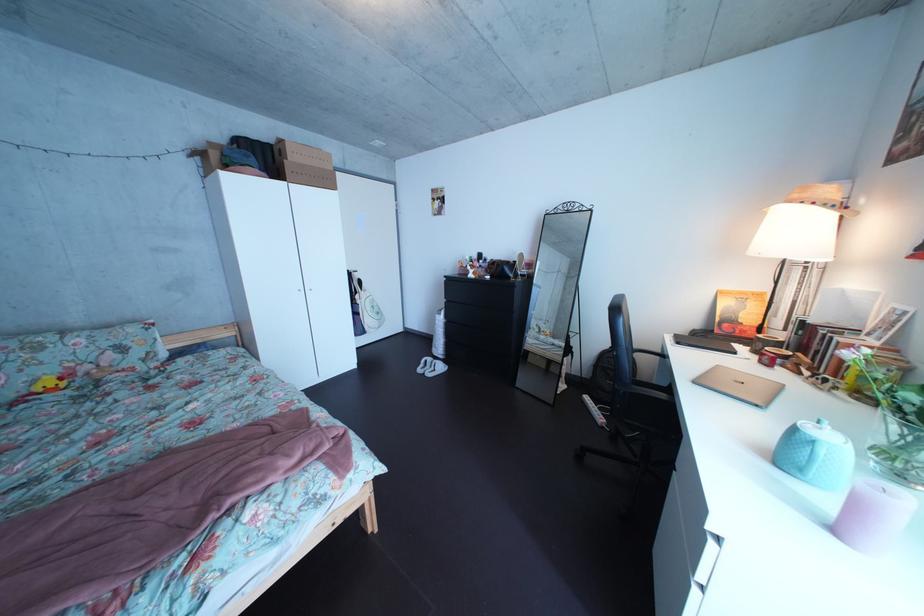
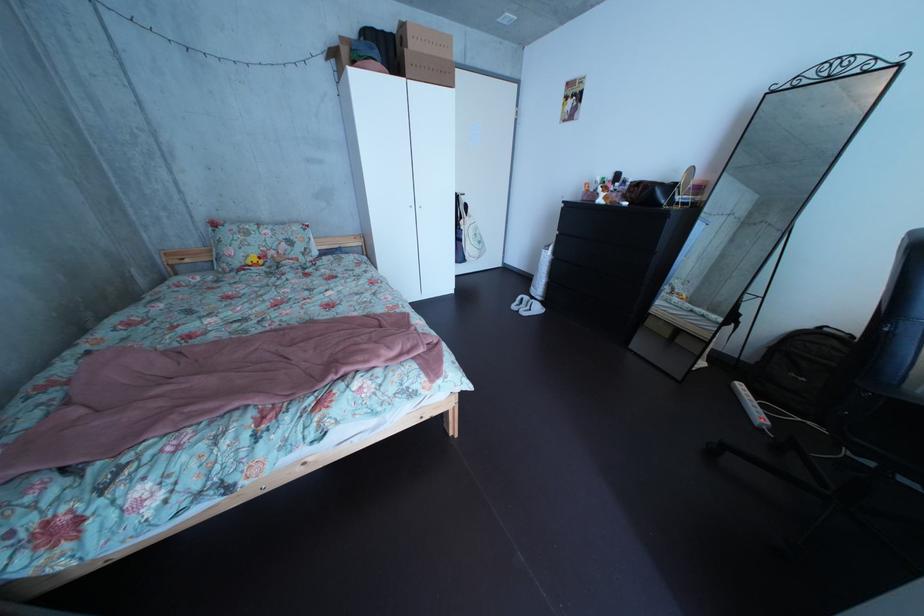
The point at [295,150] is marked in the first image. Where is the corresponding point in the second image?

(418, 34)